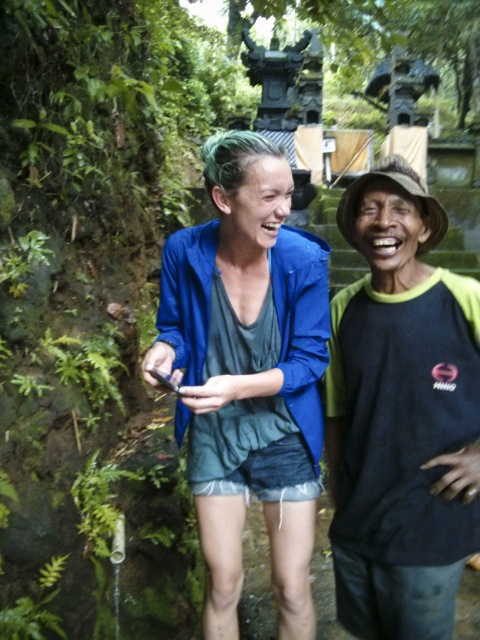
Who is positioned more to the left, blue denim shorts at lower center or black matte hat at upper right?

Positioned to the left is blue denim shorts at lower center.

Does point (267, 314) come farther from viewer compared to point (370, 273)?

That is False.

Does point (305, 624) lie behind point (420, 404)?

Yes.

The image size is (480, 640). Find the location of `blue denim shorts at lower center`. blue denim shorts at lower center is located at coordinates (248, 372).